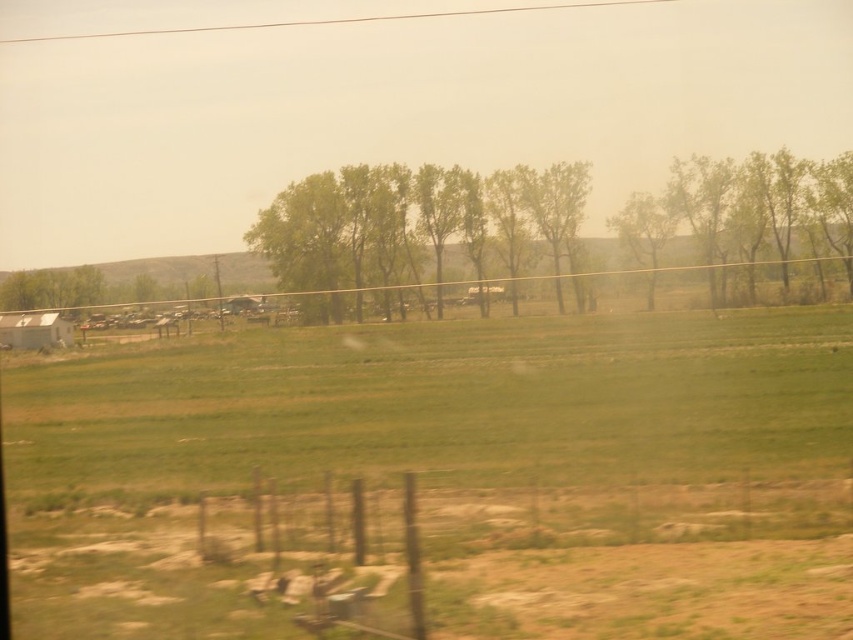
Is rusty wire fence at lower center smaller than green leafy trees at center?

Correct, rusty wire fence at lower center occupies less space than green leafy trees at center.

Does rusty wire fence at lower center appear on the right side of green leafy trees at center?

In fact, rusty wire fence at lower center is to the left of green leafy trees at center.

Is point (780, 612) more distant than point (846, 160)?

No, (780, 612) is in front of (846, 160).

Find the location of `rusty wire fence at lower center`. rusty wire fence at lower center is located at coordinates (531, 557).

Does point (407, 300) lie behind point (566, 198)?

That is False.

Does green leafy trees at center appear on the right side of green leafy tree at center?

Indeed, green leafy trees at center is positioned on the right side of green leafy tree at center.

The width and height of the screenshot is (853, 640). What do you see at coordinates (549, 234) in the screenshot?
I see `green leafy trees at center` at bounding box center [549, 234].

Identify the location of green leafy trees at center. This screenshot has width=853, height=640. pos(549,234).

Between point (264, 602) and point (555, 241), which one is positioned behind?

The point (555, 241) is more distant.

Does rusty wire fence at lower center have a lesser width compared to green leafy tree at center?

In fact, rusty wire fence at lower center might be wider than green leafy tree at center.

Does point (366, 513) come in front of point (553, 244)?

Yes, it is.

Locate an element on the screen. Image resolution: width=853 pixels, height=640 pixels. rusty wire fence at lower center is located at coordinates (531, 557).